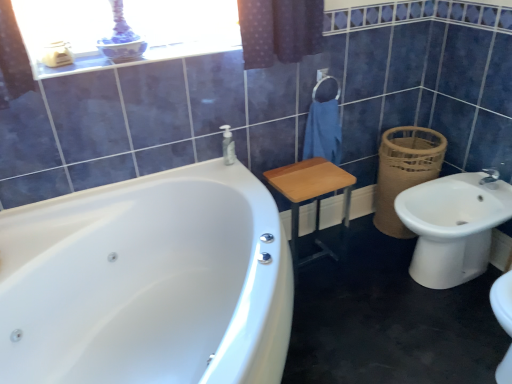
Question: Considering their positions, is brown woven basket at right located in front of or behind white glossy bathtub at left?

Choices:
 (A) front
 (B) behind

Answer: (B)

Question: Is brown woven basket at right wider or thinner than white glossy bathtub at left?

Choices:
 (A) wide
 (B) thin

Answer: (B)

Question: Based on their relative distances, which object is nearer to the white glossy sink at lower right?

Choices:
 (A) brown woven basket at right
 (B) blue cotton towel at center
 (C) white glossy balustrade at upper center
 (D) white glossy bathtub at left
 (E) wooden stool at center

Answer: (A)

Question: Which is farther from the brown woven basket at right?

Choices:
 (A) white glossy balustrade at upper center
 (B) white glossy bathtub at left
 (C) clear plastic soap dispenser at upper center
 (D) white glossy sink at lower right
 (E) wooden stool at center

Answer: (B)